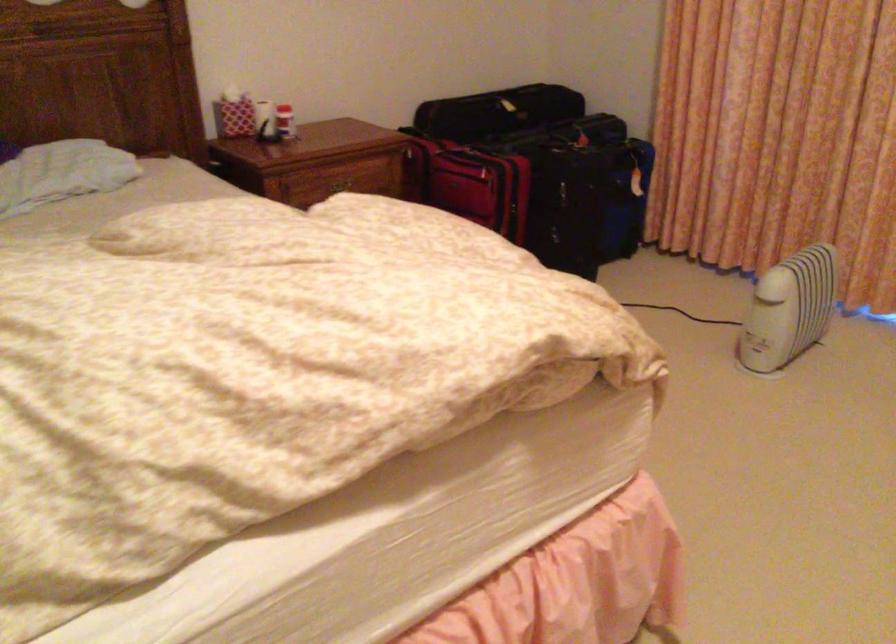
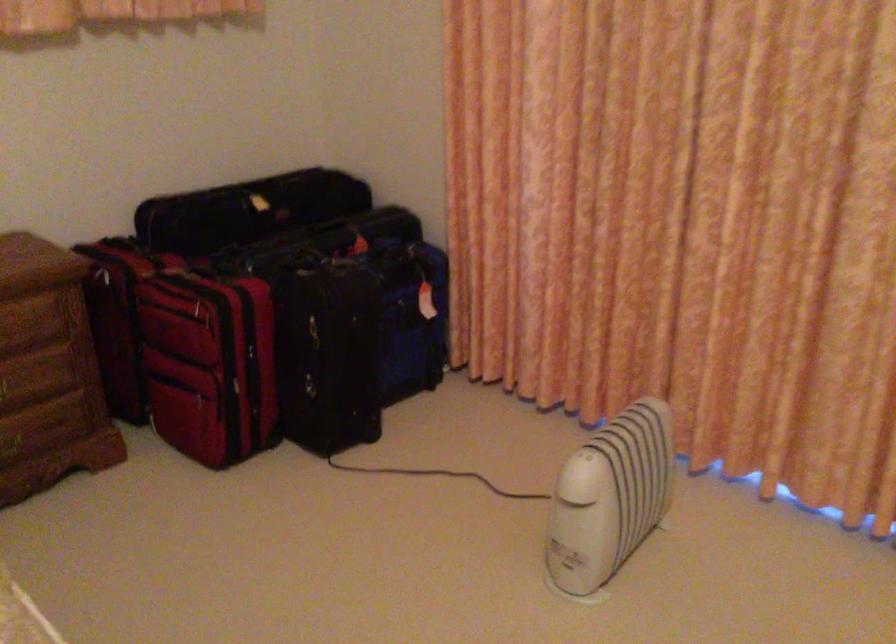
In the second image, find the point that corresponds to point (480, 214) in the first image.

(209, 364)